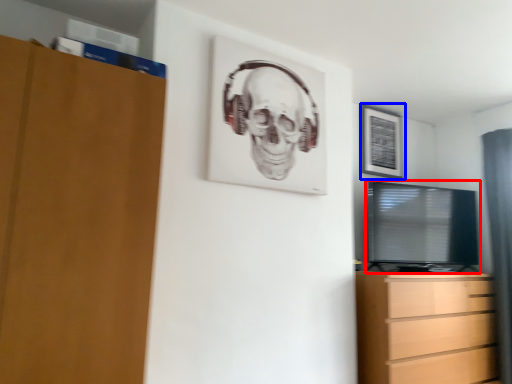
Question: Which object appears farthest to the camera in this image, television (highlighted by a red box) or picture frame (highlighted by a blue box)?

Choices:
 (A) television
 (B) picture frame

Answer: (B)